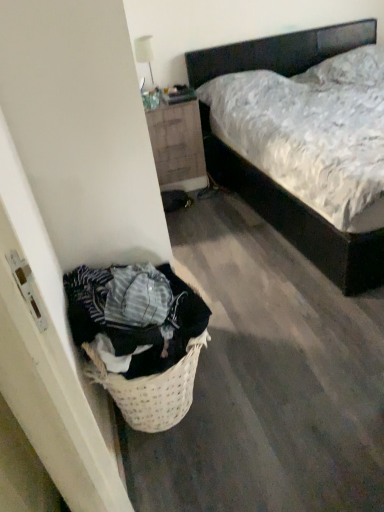
Question: Visually, is wooden nightstand at upper center positioned to the left or to the right of dark wood bed at center?

Choices:
 (A) right
 (B) left

Answer: (B)

Question: Is wooden nightstand at upper center inside the boundaries of dark wood bed at center, or outside?

Choices:
 (A) inside
 (B) outside

Answer: (B)

Question: Relative to dark wood bed at center, is wooden nightstand at upper center in front or behind?

Choices:
 (A) behind
 (B) front

Answer: (A)

Question: In terms of size, does dark wood bed at center appear bigger or smaller than wooden nightstand at upper center?

Choices:
 (A) big
 (B) small

Answer: (A)

Question: Based on their positions, is dark wood bed at center located to the left or right of wooden nightstand at upper center?

Choices:
 (A) right
 (B) left

Answer: (A)

Question: From the image's perspective, is dark wood bed at center positioned above or below wooden nightstand at upper center?

Choices:
 (A) above
 (B) below

Answer: (A)

Question: Is dark wood bed at center in front of or behind wooden nightstand at upper center in the image?

Choices:
 (A) behind
 (B) front

Answer: (B)